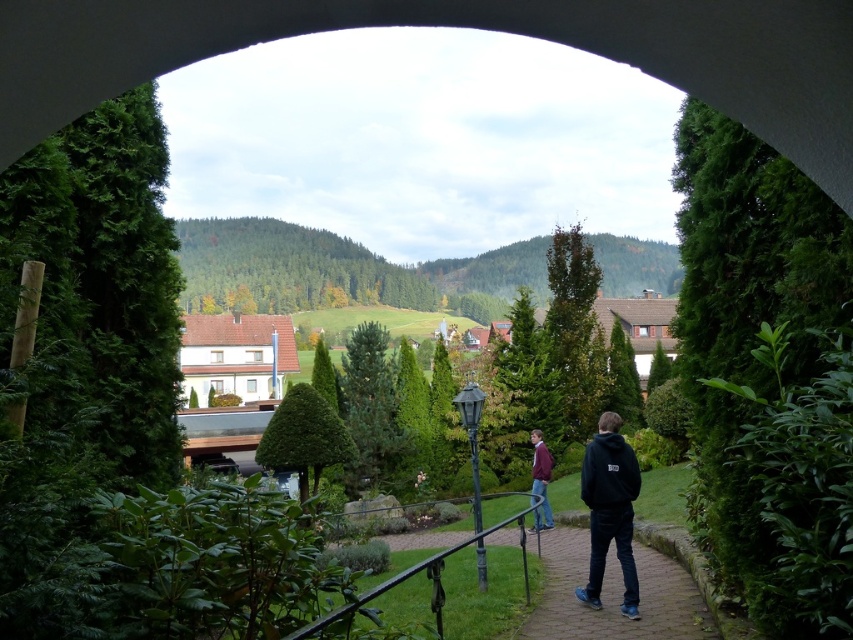
Question: Does brick paved path at center have a larger size compared to black hoodie at center?

Choices:
 (A) yes
 (B) no

Answer: (A)

Question: Is the position of green leafy hedge at right more distant than that of black wrought iron rail at center?

Choices:
 (A) yes
 (B) no

Answer: (B)

Question: Which of these objects is positioned closest to the black hoodie at center?

Choices:
 (A) black wrought iron rail at center
 (B) brick paved path at center
 (C) maroon sweater at center
 (D) green leafy hedge at right

Answer: (B)

Question: Which of the following is the closest to the observer?

Choices:
 (A) black wrought iron rail at center
 (B) green leafy hedge at right

Answer: (B)

Question: Can you confirm if black hoodie at center is positioned below black wrought iron rail at center?

Choices:
 (A) no
 (B) yes

Answer: (A)

Question: Which of the following is the farthest from the observer?

Choices:
 (A) (689, 616)
 (B) (821, 211)
 (C) (590, 570)

Answer: (C)